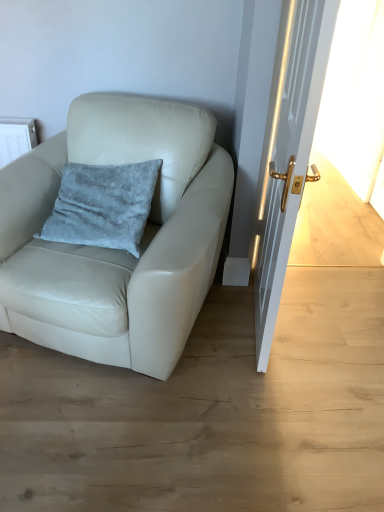
Question: Can you confirm if white glossy door at right is taller than white leather chair at left?

Choices:
 (A) yes
 (B) no

Answer: (A)

Question: Is white glossy door at right shorter than white leather chair at left?

Choices:
 (A) yes
 (B) no

Answer: (B)

Question: Is white glossy door at right with white leather chair at left?

Choices:
 (A) yes
 (B) no

Answer: (B)

Question: Could you tell me if white glossy door at right is turned towards white leather chair at left?

Choices:
 (A) no
 (B) yes

Answer: (B)

Question: Is white glossy door at right looking in the opposite direction of white leather chair at left?

Choices:
 (A) yes
 (B) no

Answer: (A)

Question: Is point (152, 185) closer or farther from the camera than point (39, 304)?

Choices:
 (A) closer
 (B) farther

Answer: (B)

Question: In terms of width, does velvety blue pillow at center-left look wider or thinner when compared to white leather chair at left?

Choices:
 (A) thin
 (B) wide

Answer: (A)

Question: From their relative heights in the image, would you say velvety blue pillow at center-left is taller or shorter than white leather chair at left?

Choices:
 (A) short
 (B) tall

Answer: (A)

Question: Visually, is velvety blue pillow at center-left positioned to the left or to the right of white leather chair at left?

Choices:
 (A) right
 (B) left

Answer: (B)

Question: Looking at the image, does white leather chair at left seem bigger or smaller compared to white glossy door at right?

Choices:
 (A) big
 (B) small

Answer: (A)

Question: Considering the positions of white leather chair at left and white glossy door at right in the image, is white leather chair at left wider or thinner than white glossy door at right?

Choices:
 (A) wide
 (B) thin

Answer: (A)

Question: In the image, is white leather chair at left on the left side or the right side of white glossy door at right?

Choices:
 (A) right
 (B) left

Answer: (B)

Question: Is point (102, 251) closer or farther from the camera than point (311, 91)?

Choices:
 (A) closer
 (B) farther

Answer: (B)

Question: In the image, is white glossy door at right positioned in front of or behind white leather chair at left?

Choices:
 (A) behind
 (B) front

Answer: (B)

Question: Is white glossy door at right to the left or to the right of white leather chair at left in the image?

Choices:
 (A) right
 (B) left

Answer: (A)